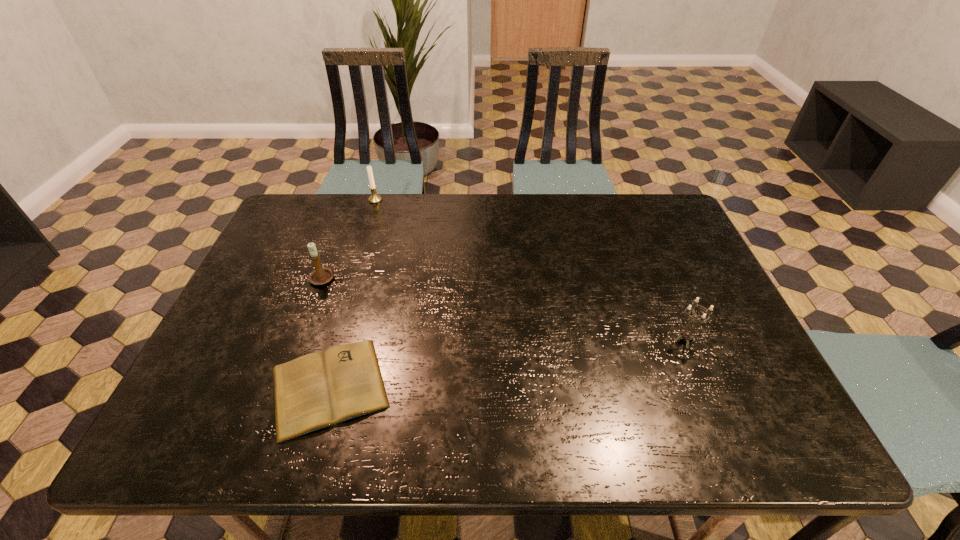
The width and height of the screenshot is (960, 540). Identify the location of free space located on the right of the book. (485, 387).

Image resolution: width=960 pixels, height=540 pixels. What are the coordinates of `object that is at the far edge` in the screenshot? It's located at (375, 198).

Identify the location of object situated at the near edge. tap(317, 390).

The width and height of the screenshot is (960, 540). Identify the location of object at the right edge. (685, 335).

Find the location of a particular element. vacant space at the far edge is located at coordinates (574, 204).

Where is `vacant space at the near edge of the desktop`? vacant space at the near edge of the desktop is located at coordinates (677, 442).

Find the location of a particular element. vacant space at the left edge of the desktop is located at coordinates (293, 294).

Find the location of `free spot at the right edge of the desktop`. free spot at the right edge of the desktop is located at coordinates (718, 291).

In the image, there is a desktop. Where is `blank space at the far left corner`? blank space at the far left corner is located at coordinates (306, 202).

At what (x,y) coordinates should I click in order to perform the action: click on free space at the far right corner of the desktop. Please return your answer as a coordinate pair (x, y). The height and width of the screenshot is (540, 960). Looking at the image, I should click on pos(650,193).